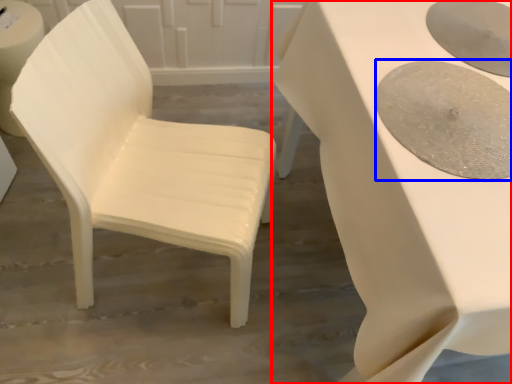
Question: Which point is closer to the camera, table (highlighted by a red box) or oval (highlighted by a blue box)?

Choices:
 (A) table
 (B) oval

Answer: (A)